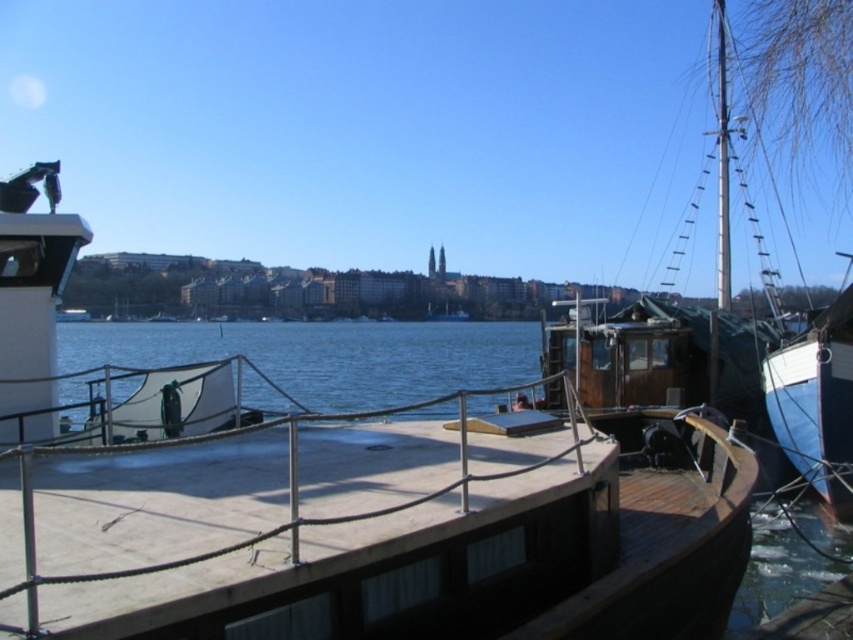
You are standing on the wooden dock and want to step onto the smooth wooden deck at center. What is the exact coordinate where you should aim to step?

The exact coordinate to step onto the smooth wooden deck at center is point (309, 532).

You are standing on the smooth wooden deck at center and want to board the wooden boat at center. Is the boat accessible from the deck?

The wooden boat at center is above smooth wooden deck at center, so you can board the wooden boat at center by stepping onto it from the deck.

You are standing on the wooden dock and looking out at the water. There are two points marked in the scene. Which point, point [404,627] or point [811,436], is closer to you?

Point [404,627] is closer to the viewer than point [811,436].